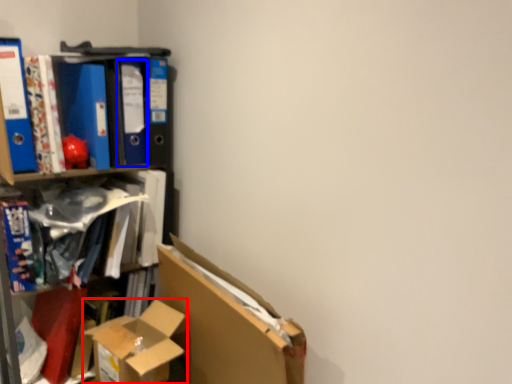
Question: Which of the following is the closest to the observer, box (highlighted by a red box) or paperback book (highlighted by a blue box)?

Choices:
 (A) box
 (B) paperback book

Answer: (A)